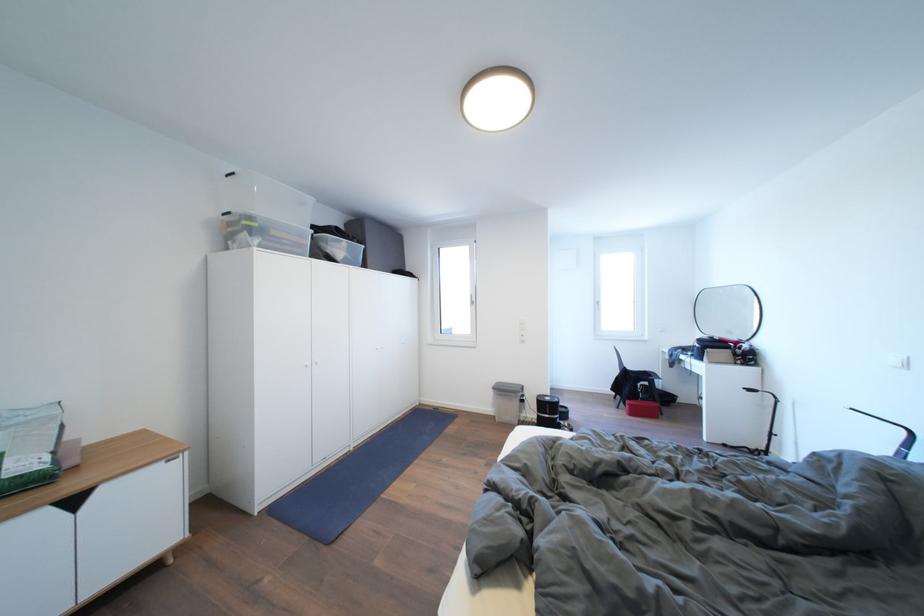
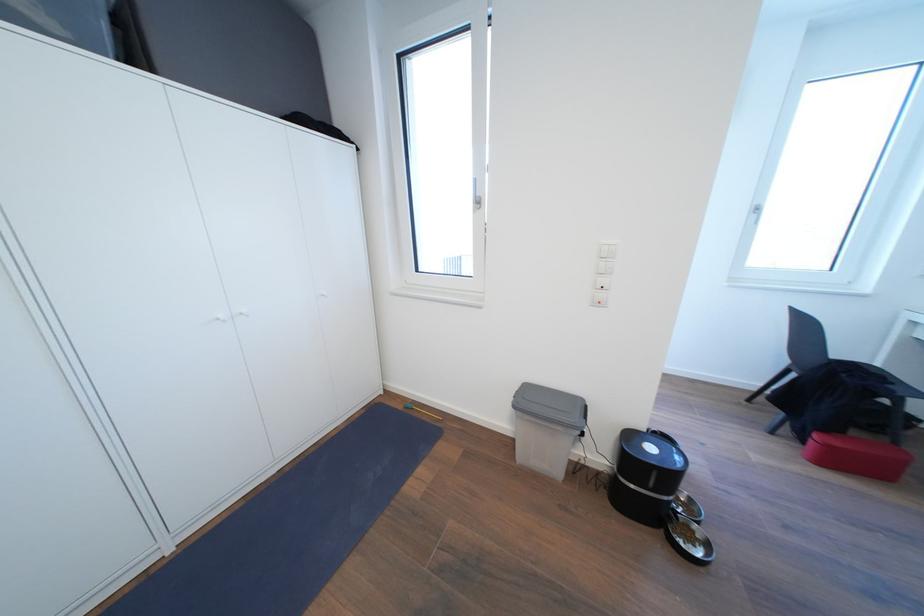
Question: Which direction would the cameraman need to move to produce the second image? Reply with the corresponding letter.

Choices:
 (A) Left
 (B) Right
 (C) Forward
 (D) Backward

Answer: (C)